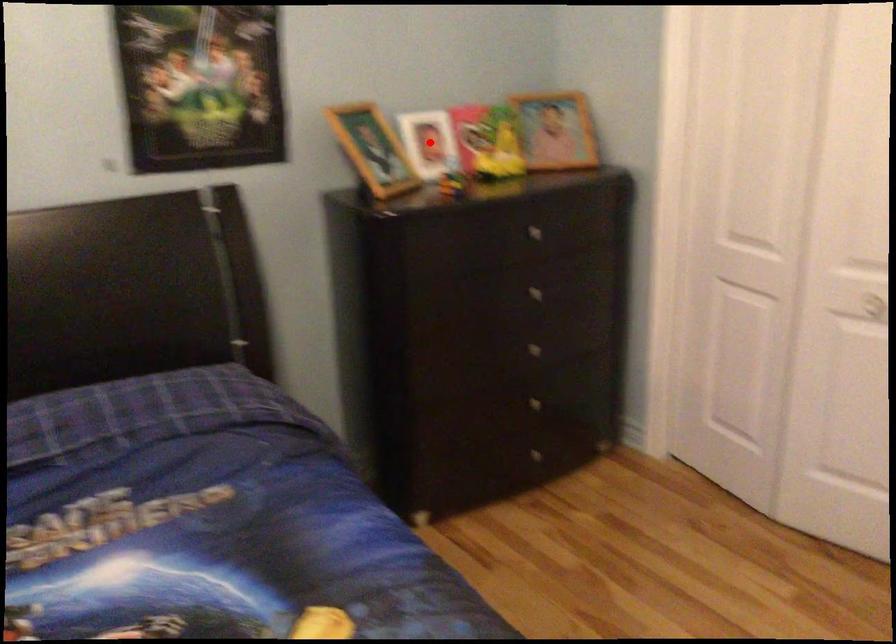
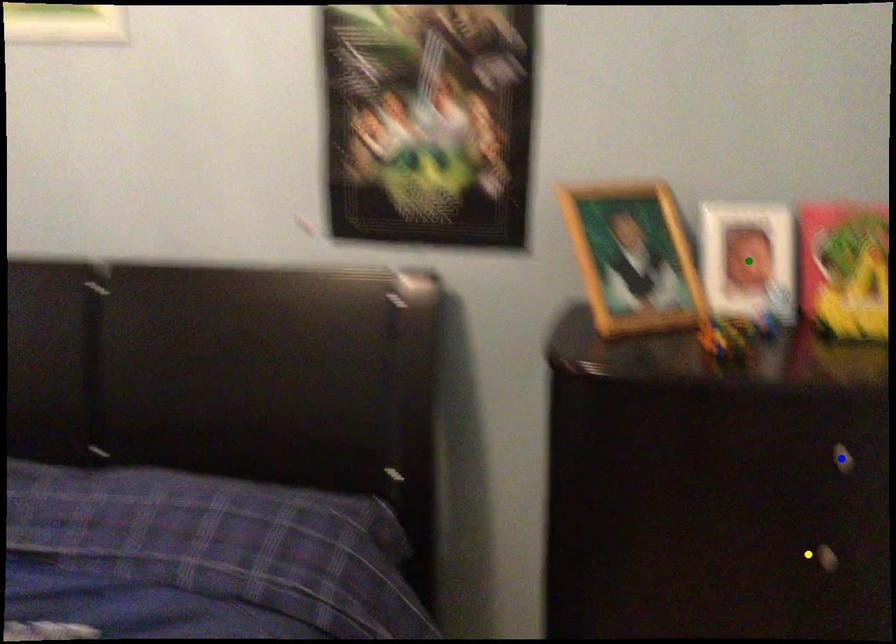
Question: I am providing you with two images of the same scene from different viewpoints. A red point is marked on the first image. You are given multiple points on the second image. In image 2, which mark is for the same physical point as the one in image 1?

Choices:
 (A) blue point
 (B) green point
 (C) yellow point

Answer: (B)